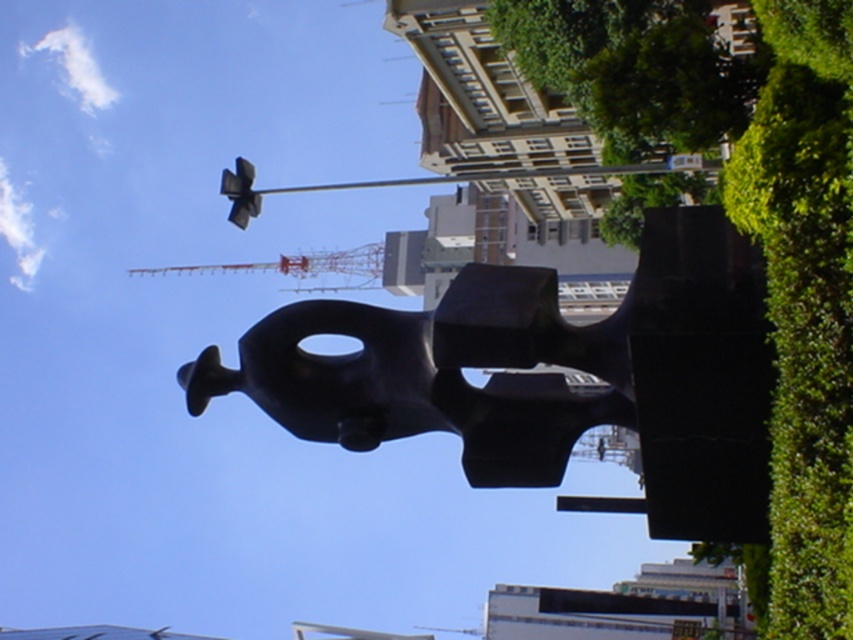
Looking at this image, does black matte statue at center appear under green leafy hedge at right?

Correct, black matte statue at center is located below green leafy hedge at right.

Between point (654, 330) and point (773, 330), which one is positioned in front?

Point (773, 330) is in front.

Identify the location of black matte statue at center. The width and height of the screenshot is (853, 640). (548, 376).